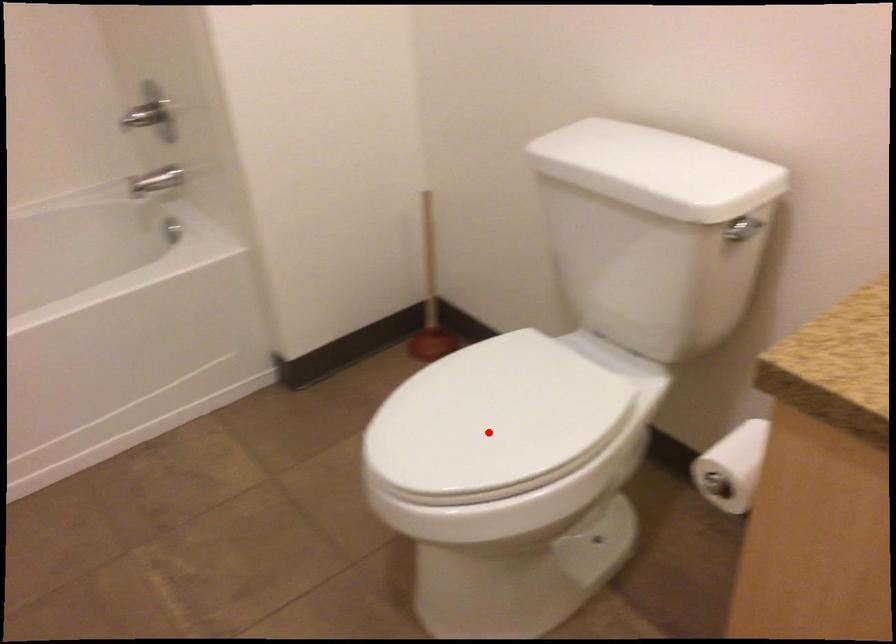
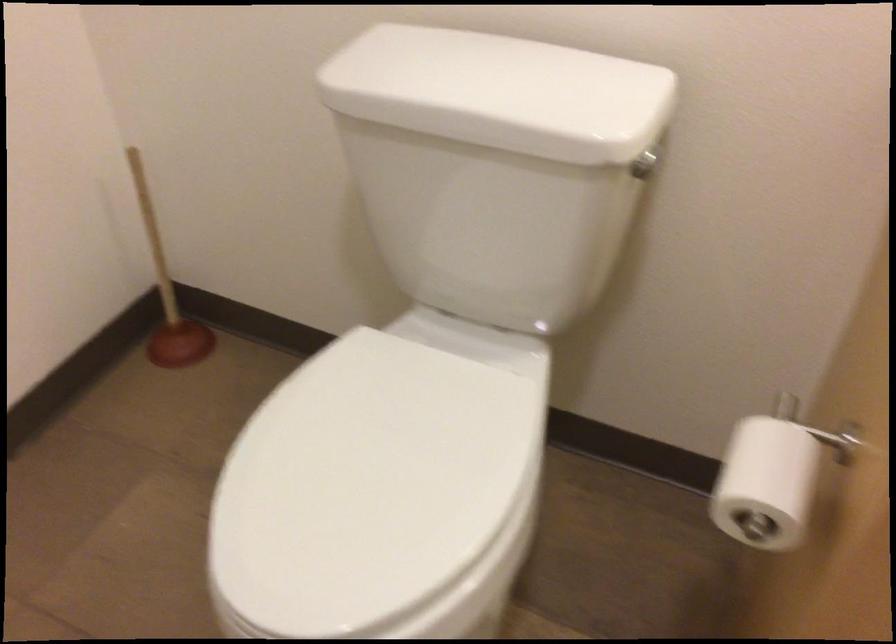
Question: I am providing you with two images of the same scene from different viewpoints. In image1, a red point is highlighted. Considering the same 3D point in image2, which of the following is correct?

Choices:
 (A) It is closer
 (B) It is farther

Answer: (A)